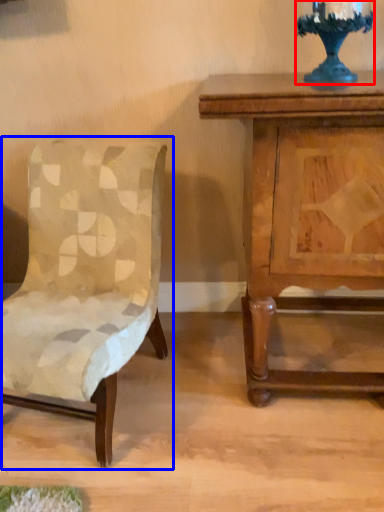
Question: Which point is further to the camera, candle holder (highlighted by a red box) or chair (highlighted by a blue box)?

Choices:
 (A) candle holder
 (B) chair

Answer: (A)